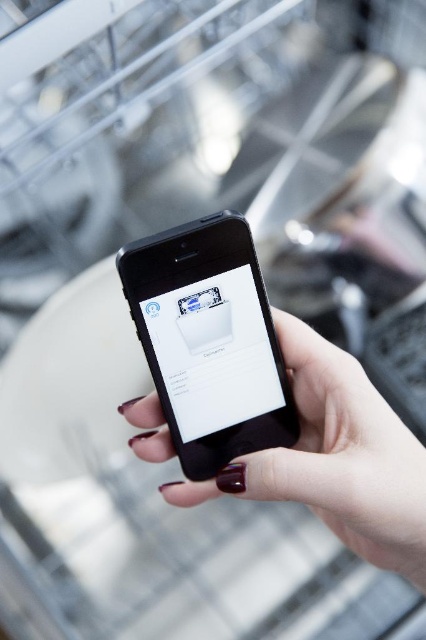
Question: Is black glossy phone at center wider than black matte phone at center?

Choices:
 (A) no
 (B) yes

Answer: (A)

Question: Which point is farther from the camera taking this photo?

Choices:
 (A) (166, 392)
 (B) (314, 461)

Answer: (A)

Question: Which of the following is the closest to the observer?

Choices:
 (A) (423, 550)
 (B) (207, 294)

Answer: (A)

Question: From the image, what is the correct spatial relationship of black glossy phone at center in relation to black matte phone at center?

Choices:
 (A) right
 (B) left

Answer: (B)

Question: Is black glossy phone at center further to the viewer compared to black matte phone at center?

Choices:
 (A) yes
 (B) no

Answer: (A)

Question: Among these objects, which one is nearest to the camera?

Choices:
 (A) black matte phone at center
 (B) black glossy phone at center

Answer: (A)